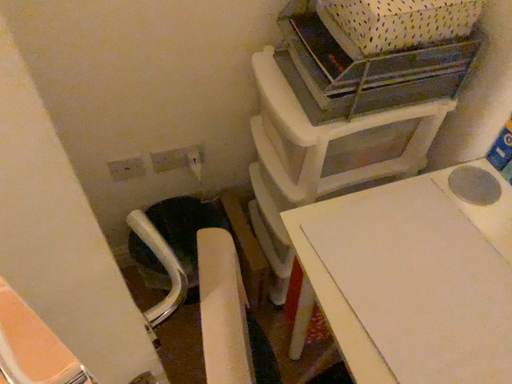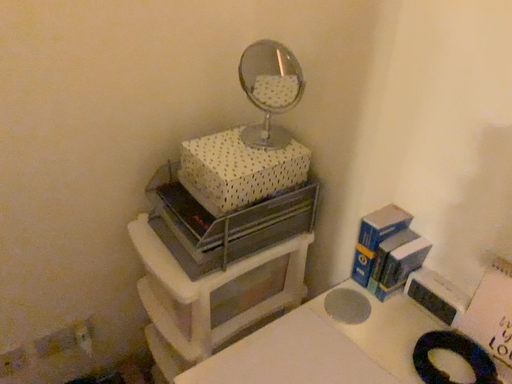
Question: How did the camera likely rotate when shooting the video?

Choices:
 (A) rotated downward
 (B) rotated upward

Answer: (B)